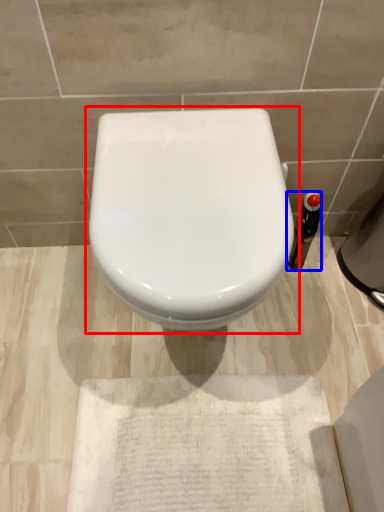
Question: Which point is closer to the camera, toilet (highlighted by a red box) or bottle (highlighted by a blue box)?

Choices:
 (A) toilet
 (B) bottle

Answer: (A)